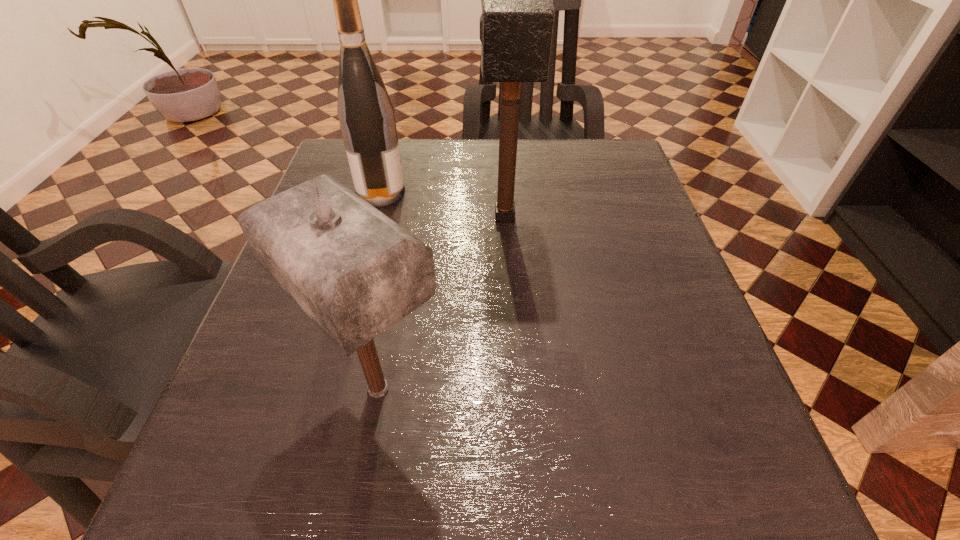
This screenshot has width=960, height=540. Identify the location of the rightmost object. (516, 25).

Find the location of a particular element. The image size is (960, 540). the farther mallet is located at coordinates (516, 25).

Where is `wine bottle`? Image resolution: width=960 pixels, height=540 pixels. wine bottle is located at coordinates (366, 115).

Locate an element on the screen. This screenshot has height=540, width=960. the shorter mallet is located at coordinates (355, 272).

Locate an element on the screen. the left mallet is located at coordinates (355, 272).

The height and width of the screenshot is (540, 960). Identify the location of vacant space situated 0.180m on the front of the farther mallet. (511, 315).

This screenshot has width=960, height=540. I want to click on vacant space located 0.330m on the front of the wine bottle, so click(x=345, y=328).

The width and height of the screenshot is (960, 540). Find the location of `free region located on the right of the shorter mallet`. free region located on the right of the shorter mallet is located at coordinates (591, 388).

Image resolution: width=960 pixels, height=540 pixels. Find the location of `mallet that is positioned at the far edge`. mallet that is positioned at the far edge is located at coordinates (516, 25).

This screenshot has height=540, width=960. Find the location of `wine bottle located in the far edge section of the desktop`. wine bottle located in the far edge section of the desktop is located at coordinates (366, 115).